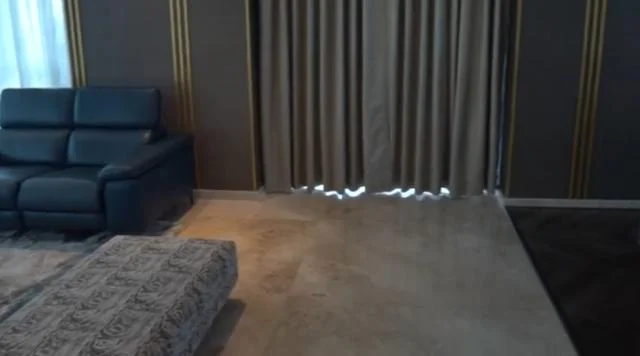
Identify the location of window. The height and width of the screenshot is (356, 640). (43, 44).